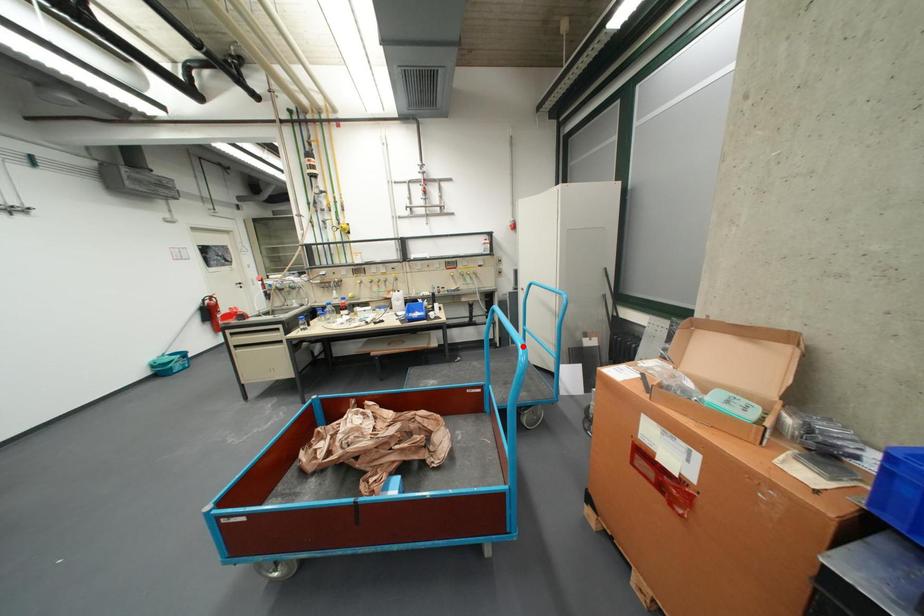
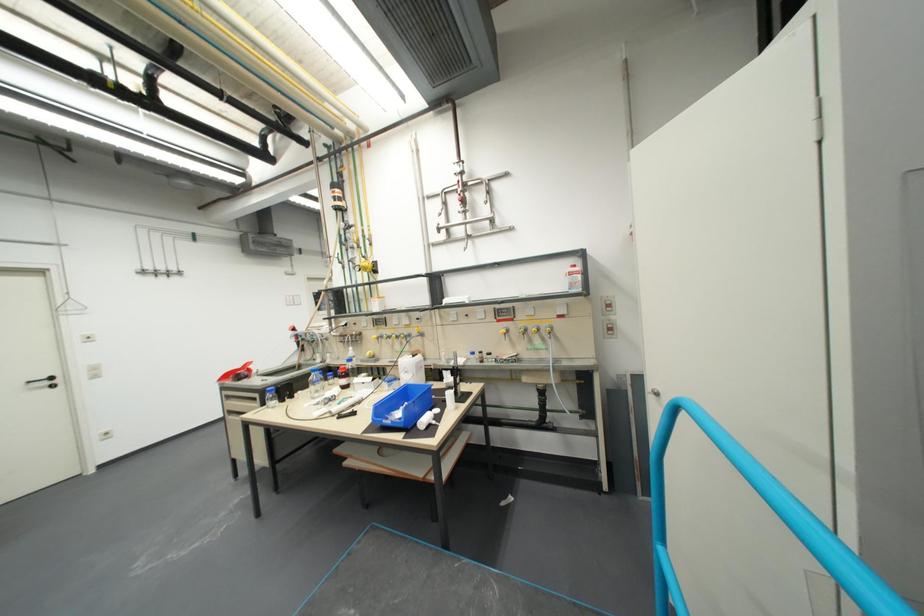
Question: I am providing you with two images of the same scene from different viewpoints. In image1, a red point is highlighted. Considering the same 3D point in image2, which of the following is correct?

Choices:
 (A) It is closer
 (B) It is farther

Answer: (A)